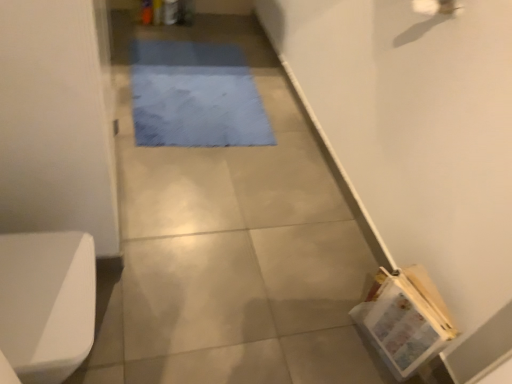
Question: From the image's perspective, is blue fabric mat at center above or below white glossy toilet bowl at lower left?

Choices:
 (A) below
 (B) above

Answer: (B)

Question: Is blue fabric mat at center bigger or smaller than white glossy toilet bowl at lower left?

Choices:
 (A) small
 (B) big

Answer: (A)

Question: From a real-world perspective, is blue fabric mat at center positioned above or below white glossy toilet bowl at lower left?

Choices:
 (A) below
 (B) above

Answer: (A)

Question: In terms of size, does white glossy toilet bowl at lower left appear bigger or smaller than blue fabric mat at center?

Choices:
 (A) small
 (B) big

Answer: (B)

Question: Is white glossy toilet bowl at lower left taller or shorter than blue fabric mat at center?

Choices:
 (A) tall
 (B) short

Answer: (A)

Question: From a real-world perspective, is white glossy toilet bowl at lower left above or below blue fabric mat at center?

Choices:
 (A) below
 (B) above

Answer: (B)

Question: Does point (66, 332) appear closer or farther from the camera than point (231, 97)?

Choices:
 (A) closer
 (B) farther

Answer: (A)